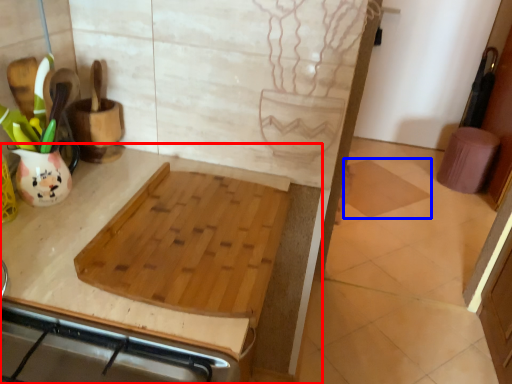
Question: Which object appears farthest to the camera in this image, countertop (highlighted by a red box) or tile (highlighted by a blue box)?

Choices:
 (A) countertop
 (B) tile

Answer: (B)